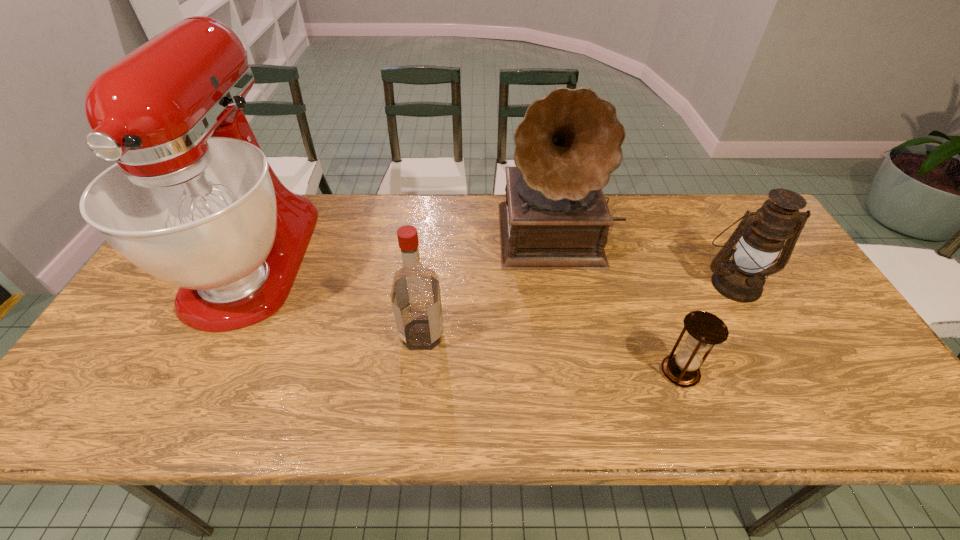
In the image, there is a desktop. Where is `vacant space at the near left corner`? vacant space at the near left corner is located at coordinates (131, 413).

The height and width of the screenshot is (540, 960). Find the location of `vacant area at the near right corner`. vacant area at the near right corner is located at coordinates (885, 415).

Where is `vacant area that lies between the second tallest object and the rightmost object`? vacant area that lies between the second tallest object and the rightmost object is located at coordinates (648, 258).

Locate an element on the screen. free area in between the leftmost object and the oil lamp is located at coordinates (494, 271).

Where is `vacant space that is in between the shortest object and the record player`? vacant space that is in between the shortest object and the record player is located at coordinates (620, 303).

The width and height of the screenshot is (960, 540). Identify the location of free space between the second tallest object and the hourglass. (620, 303).

Where is `empty location between the oil lamp and the second tallest object`? The width and height of the screenshot is (960, 540). empty location between the oil lamp and the second tallest object is located at coordinates (648, 258).

Locate an element on the screen. vacant region between the rightmost object and the mixer is located at coordinates (494, 271).

In order to click on empty space that is in between the rightmost object and the record player in this screenshot , I will do `click(648, 258)`.

Identify which object is the closest to the rightmost object. Please provide its 2D coordinates. Your answer should be formatted as a tuple, i.e. [(x, y)], where the tuple contains the x and y coordinates of a point satisfying the conditions above.

[(555, 217)]